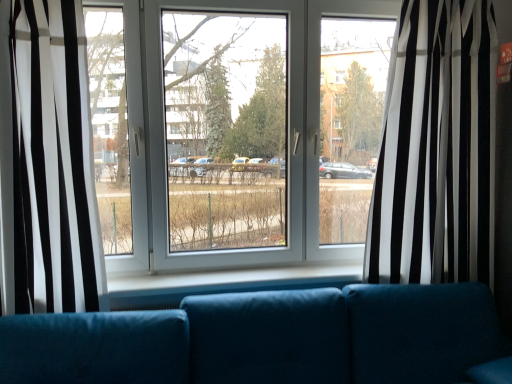
The image size is (512, 384). I want to click on black/white striped curtain at center, which is the 2th curtain from left to right, so click(x=437, y=146).

You are a GUI agent. You are given a task and a screenshot of the screen. Output one action in this format:
    pyautogui.click(x=<x>, y=<y>)
    Task: Click on the teal fabric couch at center
    This screenshot has height=384, width=512.
    Given the screenshot: What is the action you would take?
    pyautogui.click(x=268, y=339)

From the image's perspective, does black/white striped curtain at center, the 1th curtain in the right-to-left sequence, appear higher than teal fabric couch at center?

Yes, from the image's perspective, black/white striped curtain at center, the 1th curtain in the right-to-left sequence, is above teal fabric couch at center.

Which of these two, black/white striped curtain at center, which is the 2th curtain from left to right, or teal fabric couch at center, is smaller?

black/white striped curtain at center, which is the 2th curtain from left to right.

Would you say black/white striped curtain at center, the 1th curtain in the right-to-left sequence, is inside or outside teal fabric couch at center?

black/white striped curtain at center, the 1th curtain in the right-to-left sequence, lies outside teal fabric couch at center.

Consider the image. Between black/white striped curtain at center, which is the 2th curtain from left to right, and teal fabric couch at center, which one has less height?

Standing shorter between the two is teal fabric couch at center.

Locate an element on the screen. This screenshot has height=384, width=512. studio couch in front of the black/white striped curtain at center, the 1th curtain in the right-to-left sequence is located at coordinates (268, 339).

Considering the relative positions of teal fabric couch at center and black/white striped curtain at center, the 1th curtain in the right-to-left sequence, in the image provided, is teal fabric couch at center to the left of black/white striped curtain at center, the 1th curtain in the right-to-left sequence, from the viewer's perspective?

Yes.

Is teal fabric couch at center taller or shorter than black/white striped curtain at center, which is the 2th curtain from left to right?

teal fabric couch at center is shorter than black/white striped curtain at center, which is the 2th curtain from left to right.

Considering the relative positions of white sheer curtain at left, which is counted as the first curtain, starting from the left, and black/white striped curtain at center, which is the 2th curtain from left to right, in the image provided, is white sheer curtain at left, which is counted as the first curtain, starting from the left, to the right of black/white striped curtain at center, which is the 2th curtain from left to right, from the viewer's perspective?

No.

From the image's perspective, which one is positioned lower, white sheer curtain at left, which is the 2th curtain from right to left, or black/white striped curtain at center, which is the 2th curtain from left to right?

white sheer curtain at left, which is the 2th curtain from right to left.

Between white sheer curtain at left, which is the 2th curtain from right to left, and black/white striped curtain at center, which is the 2th curtain from left to right, which one is positioned behind?

black/white striped curtain at center, which is the 2th curtain from left to right, is further away from the camera.

Which is in front, point (0, 94) or point (413, 66)?

The point (0, 94) is in front.

From a real-world perspective, is white sheer curtain at left, which is counted as the first curtain, starting from the left, physically above teal fabric couch at center?

Correct, in the physical world, white sheer curtain at left, which is counted as the first curtain, starting from the left, is higher than teal fabric couch at center.

Looking at this image, considering the sizes of white sheer curtain at left, which is the 2th curtain from right to left, and teal fabric couch at center in the image, is white sheer curtain at left, which is the 2th curtain from right to left, taller or shorter than teal fabric couch at center?

Clearly, white sheer curtain at left, which is the 2th curtain from right to left, is taller compared to teal fabric couch at center.

Would you say white sheer curtain at left, which is counted as the first curtain, starting from the left, is outside teal fabric couch at center?

white sheer curtain at left, which is counted as the first curtain, starting from the left, lies outside teal fabric couch at center's area.

Based on the photo, which of these two, black/white striped curtain at center, which is the 2th curtain from left to right, or white sheer curtain at left, which is counted as the first curtain, starting from the left, stands taller?

black/white striped curtain at center, which is the 2th curtain from left to right, is taller.

This screenshot has width=512, height=384. Identify the location of curtain above the white sheer curtain at left, which is counted as the first curtain, starting from the left (from a real-world perspective). (437, 146).

In the scene shown: Which is in front, black/white striped curtain at center, the 1th curtain in the right-to-left sequence, or white sheer curtain at left, which is counted as the first curtain, starting from the left?

white sheer curtain at left, which is counted as the first curtain, starting from the left, is closer to the camera.

Does black/white striped curtain at center, which is the 2th curtain from left to right, have a larger size compared to white sheer curtain at left, which is counted as the first curtain, starting from the left?

Correct, black/white striped curtain at center, which is the 2th curtain from left to right, is larger in size than white sheer curtain at left, which is counted as the first curtain, starting from the left.

In the scene shown: Between teal fabric couch at center and white sheer curtain at left, which is counted as the first curtain, starting from the left, which one has smaller width?

white sheer curtain at left, which is counted as the first curtain, starting from the left, is thinner.

Between point (314, 302) and point (63, 220), which one is positioned behind?

The point (63, 220) is farther.

Considering the relative sizes of teal fabric couch at center and white sheer curtain at left, which is counted as the first curtain, starting from the left, in the image provided, is teal fabric couch at center taller than white sheer curtain at left, which is counted as the first curtain, starting from the left,?

Incorrect, the height of teal fabric couch at center is not larger of that of white sheer curtain at left, which is counted as the first curtain, starting from the left.

Consider the image. From the image's perspective, is teal fabric couch at center on white sheer curtain at left, which is the 2th curtain from right to left?

No.

Image resolution: width=512 pixels, height=384 pixels. Find the location of `studio couch in front of the black/white striped curtain at center, which is the 2th curtain from left to right`. studio couch in front of the black/white striped curtain at center, which is the 2th curtain from left to right is located at coordinates point(268,339).

Identify the location of studio couch on the left of black/white striped curtain at center, the 1th curtain in the right-to-left sequence. The image size is (512, 384). click(268, 339).

Which object lies further to the anchor point teal fabric couch at center, white sheer curtain at left, which is the 2th curtain from right to left, or black/white striped curtain at center, the 1th curtain in the right-to-left sequence?

white sheer curtain at left, which is the 2th curtain from right to left.

Based on their spatial positions, is teal fabric couch at center or white sheer curtain at left, which is the 2th curtain from right to left, further from black/white striped curtain at center, which is the 2th curtain from left to right?

The object further to black/white striped curtain at center, which is the 2th curtain from left to right, is white sheer curtain at left, which is the 2th curtain from right to left.

Based on their spatial positions, is black/white striped curtain at center, which is the 2th curtain from left to right, or teal fabric couch at center closer to white sheer curtain at left, which is the 2th curtain from right to left?

teal fabric couch at center is positioned closer to the anchor white sheer curtain at left, which is the 2th curtain from right to left.

Estimate the real-world distances between objects in this image. Which object is closer to white sheer curtain at left, which is counted as the first curtain, starting from the left, teal fabric couch at center or black/white striped curtain at center, the 1th curtain in the right-to-left sequence?

Among the two, teal fabric couch at center is located nearer to white sheer curtain at left, which is counted as the first curtain, starting from the left.

When comparing their distances from teal fabric couch at center, does black/white striped curtain at center, the 1th curtain in the right-to-left sequence, or white sheer curtain at left, which is the 2th curtain from right to left, seem closer?

black/white striped curtain at center, the 1th curtain in the right-to-left sequence.

Which object lies further to the anchor point black/white striped curtain at center, which is the 2th curtain from left to right, white sheer curtain at left, which is counted as the first curtain, starting from the left, or teal fabric couch at center?

The object further to black/white striped curtain at center, which is the 2th curtain from left to right, is white sheer curtain at left, which is counted as the first curtain, starting from the left.

Where is `studio couch situated between white sheer curtain at left, which is counted as the first curtain, starting from the left, and black/white striped curtain at center, the 1th curtain in the right-to-left sequence, from left to right`? The width and height of the screenshot is (512, 384). studio couch situated between white sheer curtain at left, which is counted as the first curtain, starting from the left, and black/white striped curtain at center, the 1th curtain in the right-to-left sequence, from left to right is located at coordinates pyautogui.click(x=268, y=339).